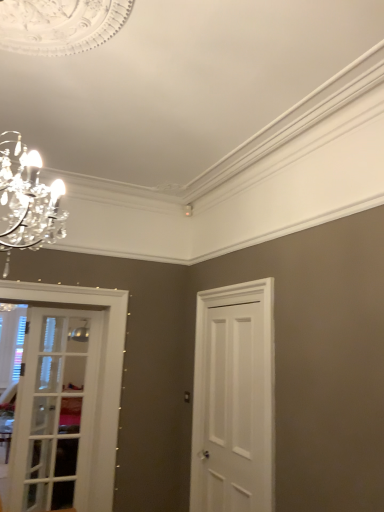
What is the approximate width of white glass door at left, which is the 1th door from left to right?

The width of white glass door at left, which is the 1th door from left to right, is 1.76 inches.

Where is `white glass door at left, which is the 1th door from left to right`? The height and width of the screenshot is (512, 384). white glass door at left, which is the 1th door from left to right is located at coordinates (56, 411).

The image size is (384, 512). What do you see at coordinates (56, 411) in the screenshot? I see `white glass door at left, the 2th door from the right` at bounding box center [56, 411].

What is the approximate height of white painted wood door at right, which is the second door from left to right?

The height of white painted wood door at right, which is the second door from left to right, is 1.80 meters.

This screenshot has width=384, height=512. What do you see at coordinates (234, 399) in the screenshot?
I see `white painted wood door at right, which is the second door from left to right` at bounding box center [234, 399].

The image size is (384, 512). Identify the location of white painted wood door at right, which is the second door from left to right. (234, 399).

Find the location of a particular element. white glass door at left, the 2th door from the right is located at coordinates (56, 411).

Considering the positions of objects white glass door at left, which is the 1th door from left to right, and white painted wood door at right, which is the second door from left to right, in the image provided, who is more to the right, white glass door at left, which is the 1th door from left to right, or white painted wood door at right, which is the second door from left to right,?

From the viewer's perspective, white painted wood door at right, which is the second door from left to right, appears more on the right side.

Is white glass door at left, the 2th door from the right, positioned in front of white painted wood door at right, arranged as the 1th door when viewed from the right?

No, white glass door at left, the 2th door from the right, is behind white painted wood door at right, arranged as the 1th door when viewed from the right.

Is point (22, 415) closer or farther from the camera than point (222, 403)?

Point (22, 415).

From the image's perspective, which is above, white glass door at left, which is the 1th door from left to right, or white painted wood door at right, which is the second door from left to right?

white painted wood door at right, which is the second door from left to right, is shown above in the image.

From a real-world perspective, which is physically above, white glass door at left, which is the 1th door from left to right, or white painted wood door at right, which is the second door from left to right?

white painted wood door at right, which is the second door from left to right.

Does white glass door at left, the 2th door from the right, have a greater width compared to white painted wood door at right, arranged as the 1th door when viewed from the right?

In fact, white glass door at left, the 2th door from the right, might be narrower than white painted wood door at right, arranged as the 1th door when viewed from the right.

Can you confirm if white glass door at left, which is the 1th door from left to right, is shorter than white painted wood door at right, which is the second door from left to right?

Yes, white glass door at left, which is the 1th door from left to right, is shorter than white painted wood door at right, which is the second door from left to right.

Is white glass door at left, which is the 1th door from left to right, bigger or smaller than white painted wood door at right, arranged as the 1th door when viewed from the right?

Clearly, white glass door at left, which is the 1th door from left to right, is smaller in size than white painted wood door at right, arranged as the 1th door when viewed from the right.

Which is correct: white glass door at left, the 2th door from the right, is inside white painted wood door at right, arranged as the 1th door when viewed from the right, or outside of it?

The correct answer is: outside.

Is white glass door at left, the 2th door from the right, not close to white painted wood door at right, arranged as the 1th door when viewed from the right?

Yes.

Does white glass door at left, the 2th door from the right, turn towards white painted wood door at right, which is the second door from left to right?

No, white glass door at left, the 2th door from the right, is not turned towards white painted wood door at right, which is the second door from left to right.

Can you tell me how much white glass door at left, which is the 1th door from left to right, and white painted wood door at right, arranged as the 1th door when viewed from the right, differ in facing direction?

The facing directions of white glass door at left, which is the 1th door from left to right, and white painted wood door at right, arranged as the 1th door when viewed from the right, are 90.5 degrees apart.

Measure the distance between white glass door at left, the 2th door from the right, and white painted wood door at right, arranged as the 1th door when viewed from the right.

They are 4.12 feet apart.

At what (x,y) coordinates should I click in order to perform the action: click on door below the white painted wood door at right, which is the second door from left to right (from a real-world perspective). Please return your answer as a coordinate pair (x, y). Looking at the image, I should click on (56, 411).

Which is more to the left, white painted wood door at right, which is the second door from left to right, or white glass door at left, the 2th door from the right?

Positioned to the left is white glass door at left, the 2th door from the right.

Relative to white glass door at left, the 2th door from the right, is white painted wood door at right, arranged as the 1th door when viewed from the right, in front or behind?

white painted wood door at right, arranged as the 1th door when viewed from the right, is positioned closer to the viewer than white glass door at left, the 2th door from the right.

Between point (193, 459) and point (61, 497), which one is positioned behind?

The point (61, 497) is behind.

From the image's perspective, which one is positioned lower, white painted wood door at right, arranged as the 1th door when viewed from the right, or white glass door at left, the 2th door from the right?

white glass door at left, the 2th door from the right, appears lower in the image.

From the picture: From a real-world perspective, is white painted wood door at right, which is the second door from left to right, over white glass door at left, the 2th door from the right?

Correct, in the physical world, white painted wood door at right, which is the second door from left to right, is higher than white glass door at left, the 2th door from the right.

Considering the sizes of white painted wood door at right, which is the second door from left to right, and white glass door at left, the 2th door from the right, in the image, is white painted wood door at right, which is the second door from left to right, wider or thinner than white glass door at left, the 2th door from the right,?

Considering their sizes, white painted wood door at right, which is the second door from left to right, looks broader than white glass door at left, the 2th door from the right.

Is white painted wood door at right, arranged as the 1th door when viewed from the right, taller than white glass door at left, the 2th door from the right?

Indeed, white painted wood door at right, arranged as the 1th door when viewed from the right, has a greater height compared to white glass door at left, the 2th door from the right.

Considering the sizes of white painted wood door at right, arranged as the 1th door when viewed from the right, and white glass door at left, which is the 1th door from left to right, in the image, is white painted wood door at right, arranged as the 1th door when viewed from the right, bigger or smaller than white glass door at left, which is the 1th door from left to right,?

Considering their sizes, white painted wood door at right, arranged as the 1th door when viewed from the right, takes up more space than white glass door at left, which is the 1th door from left to right.

Can white glass door at left, the 2th door from the right, be found inside white painted wood door at right, which is the second door from left to right?

Definitely not — white glass door at left, the 2th door from the right, is not inside white painted wood door at right, which is the second door from left to right.

Is white painted wood door at right, arranged as the 1th door when viewed from the right, directly adjacent to white glass door at left, the 2th door from the right?

No.

Is white painted wood door at right, which is the second door from left to right, facing away from white glass door at left, the 2th door from the right?

No, white painted wood door at right, which is the second door from left to right,'s orientation is not away from white glass door at left, the 2th door from the right.

How distant is white painted wood door at right, which is the second door from left to right, from white glass door at left, the 2th door from the right?

1.25 meters.

Locate an element on the screen. door behind the white painted wood door at right, which is the second door from left to right is located at coordinates (56, 411).

Identify the location of door behind the white painted wood door at right, which is the second door from left to right. (56, 411).

At what (x,y) coordinates should I click in order to perform the action: click on door on the right of white glass door at left, the 2th door from the right. Please return your answer as a coordinate pair (x, y). Looking at the image, I should click on (234, 399).